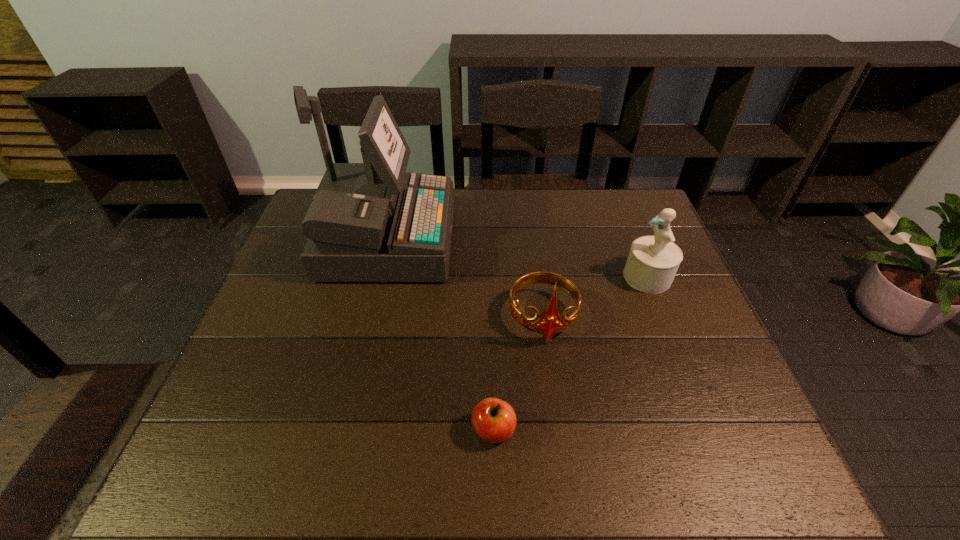
The height and width of the screenshot is (540, 960). Identify the location of cash register. [368, 222].

In order to click on the leftmost object in this screenshot , I will do `click(368, 222)`.

Locate an element on the screen. figurine is located at coordinates (652, 263).

Where is `tiara`? This screenshot has width=960, height=540. tiara is located at coordinates (550, 322).

Image resolution: width=960 pixels, height=540 pixels. Identify the location of apple. (494, 420).

I want to click on the shortest object, so click(494, 420).

Identify the location of free space located 0.170m on the customer-facing side of the cash register. (509, 242).

The height and width of the screenshot is (540, 960). I want to click on free region located at the beak of the figurine, so click(565, 277).

Locate an element on the screen. vacant point located 0.350m at the beak of the figurine is located at coordinates (497, 277).

You are a GUI agent. You are given a task and a screenshot of the screen. Output one action in this format:
    pyautogui.click(x=<x>, y=<y>)
    Task: Click on the free location located at the beak of the figurine
    The image size is (960, 540).
    Given the screenshot: What is the action you would take?
    pyautogui.click(x=555, y=277)